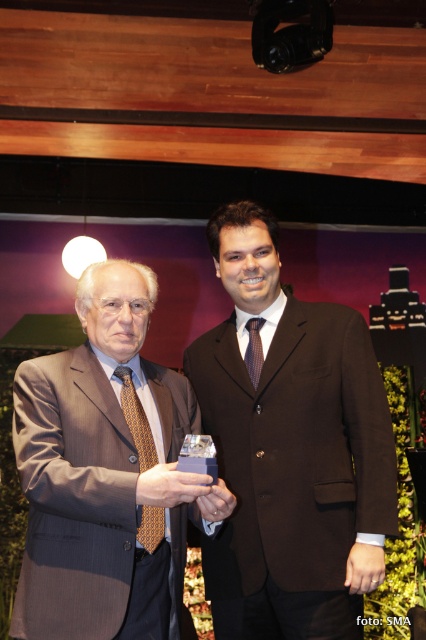
Who is more distant from viewer, (x=239, y=630) or (x=129, y=387)?

Positioned behind is point (x=239, y=630).

Between brown suit at center and matte brown suit at center, which one appears on the left side from the viewer's perspective?

From the viewer's perspective, matte brown suit at center appears more on the left side.

Measure the distance between point (x=250, y=540) and camera.

6.24 feet

Identify the location of brown suit at center. This screenshot has width=426, height=640. (290, 448).